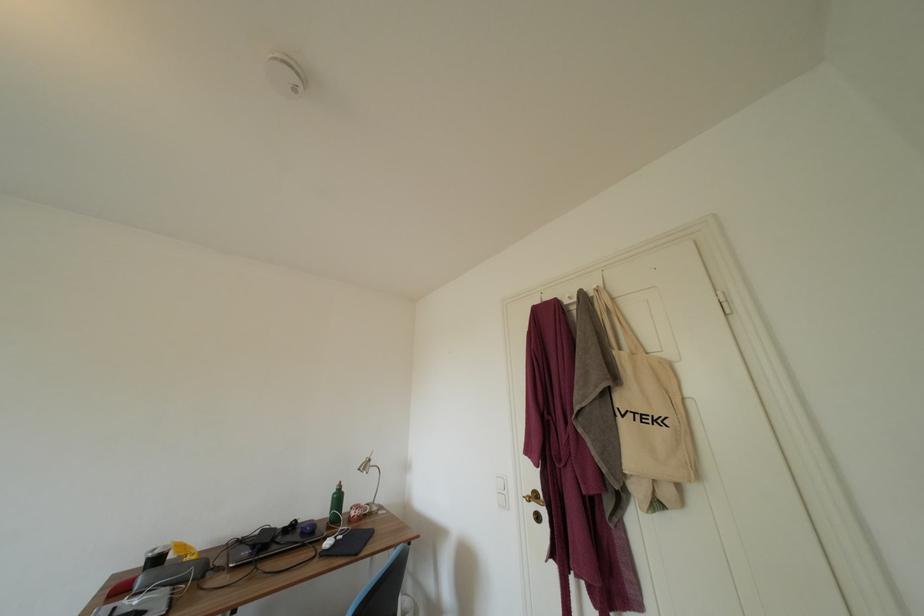
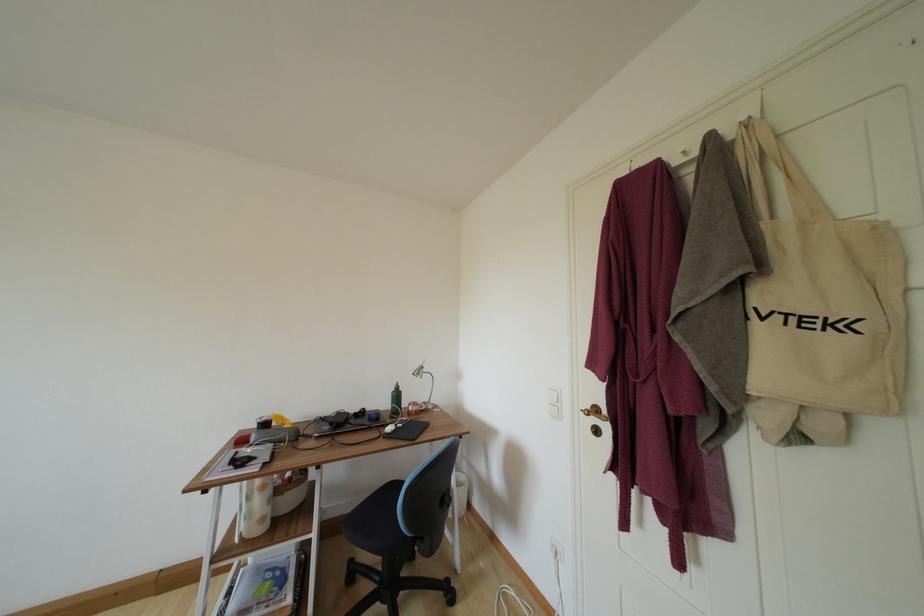
Find the pixel in the second image that matches point (339, 498) in the first image.

(398, 395)